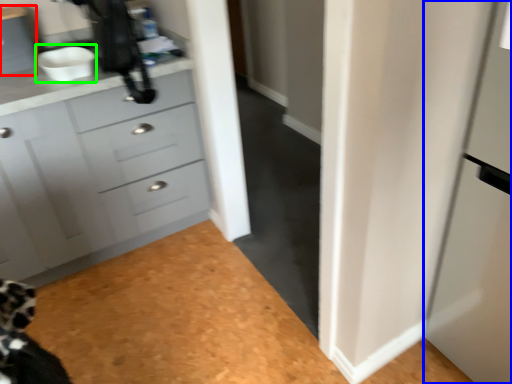
Question: Which object is the farthest from cabinetry (highlighted by a red box)? Choose among these: screen door (highlighted by a blue box) or sink (highlighted by a green box).

Choices:
 (A) screen door
 (B) sink

Answer: (A)